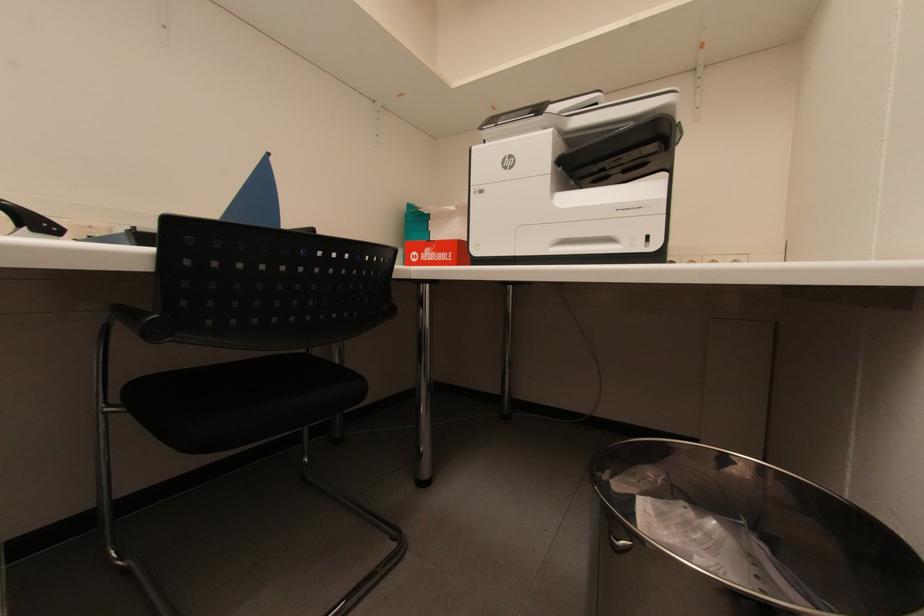
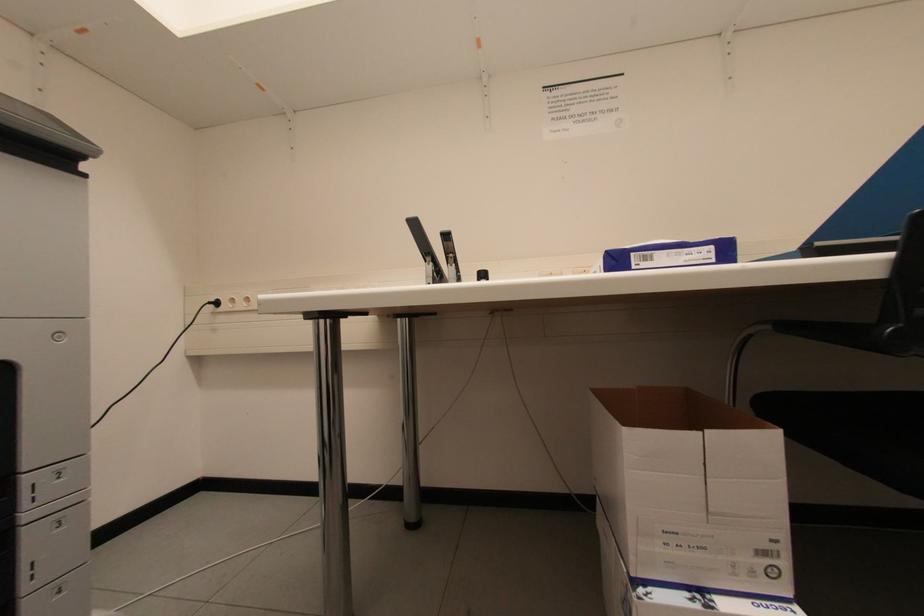
Question: The first image is from the beginning of the video and the second image is from the end. How did the camera likely rotate when shooting the video?

Choices:
 (A) Left
 (B) Right
 (C) Up
 (D) Down

Answer: (A)